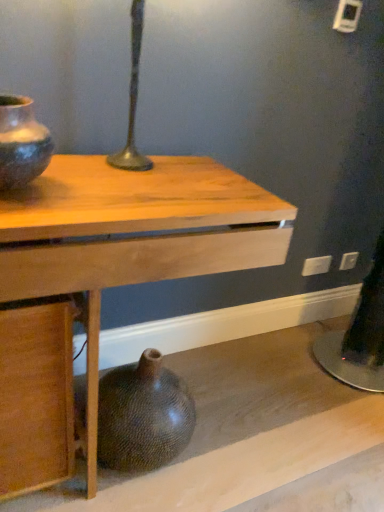
Question: From the image's perspective, is white plastic electric outlet at lower right, which ranks as the first electric outlet in left-to-right order, above brown textured vase at lower center, the first vase viewed from the back?

Choices:
 (A) yes
 (B) no

Answer: (A)

Question: Is white plastic electric outlet at lower right, which ranks as the first electric outlet in left-to-right order, placed right next to brown textured vase at lower center, the first vase viewed from the back?

Choices:
 (A) no
 (B) yes

Answer: (A)

Question: Does white plastic electric outlet at lower right, which appears as the 2th electric outlet when viewed from the back, have a greater width compared to brown textured vase at lower center, which is the first vase from bottom to top?

Choices:
 (A) no
 (B) yes

Answer: (A)

Question: From the image's perspective, is white plastic electric outlet at lower right, which ranks as the first electric outlet in left-to-right order, below brown textured vase at lower center, the 2th vase from the front?

Choices:
 (A) yes
 (B) no

Answer: (B)

Question: Is white plastic electric outlet at lower right, which ranks as the first electric outlet in left-to-right order, closer to camera compared to brown textured vase at lower center, the 2th vase from the front?

Choices:
 (A) no
 (B) yes

Answer: (A)

Question: From the image's perspective, is white plastic electric outlet at lower right, which is the first electric outlet in right-to-left order, located above or below brown textured vase at lower center, the 2th vase from the front?

Choices:
 (A) above
 (B) below

Answer: (A)

Question: Is white plastic electric outlet at lower right, which appears as the 2th electric outlet when viewed from the left, to the left or to the right of brown textured vase at lower center, the first vase viewed from the back, in the image?

Choices:
 (A) right
 (B) left

Answer: (A)

Question: In the image, is white plastic electric outlet at lower right, which is the first electric outlet in right-to-left order, positioned in front of or behind brown textured vase at lower center, which is the first vase from bottom to top?

Choices:
 (A) behind
 (B) front

Answer: (A)

Question: Considering the positions of white plastic electric outlet at lower right, which appears as the second electric outlet when viewed from the front, and brown textured vase at lower center, the 2th vase from the front, in the image, is white plastic electric outlet at lower right, which appears as the second electric outlet when viewed from the front, taller or shorter than brown textured vase at lower center, the 2th vase from the front,?

Choices:
 (A) tall
 (B) short

Answer: (B)

Question: Considering the positions of matte black vase at left, positioned as the first vase in top-to-bottom order, and wooden table at center in the image, is matte black vase at left, positioned as the first vase in top-to-bottom order, bigger or smaller than wooden table at center?

Choices:
 (A) small
 (B) big

Answer: (A)

Question: In the image, is matte black vase at left, marked as the second vase in a back-to-front arrangement, positioned in front of or behind wooden table at center?

Choices:
 (A) front
 (B) behind

Answer: (B)

Question: In the image, is matte black vase at left, marked as the first vase in a front-to-back arrangement, on the left side or the right side of wooden table at center?

Choices:
 (A) left
 (B) right

Answer: (A)

Question: Is matte black vase at left, which is counted as the 2th vase, starting from the bottom, wider or thinner than wooden table at center?

Choices:
 (A) wide
 (B) thin

Answer: (B)

Question: Based on their sizes in the image, would you say white plastic electric outlet at lower right, the 1th electric outlet positioned from the back, is bigger or smaller than white plastic electric outlet at lower right, which ranks as the first electric outlet in left-to-right order?

Choices:
 (A) small
 (B) big

Answer: (A)

Question: From a real-world perspective, is white plastic electric outlet at lower right, which appears as the 2th electric outlet when viewed from the left, above or below white plastic electric outlet at lower right, which appears as the 2th electric outlet when viewed from the back?

Choices:
 (A) above
 (B) below

Answer: (A)